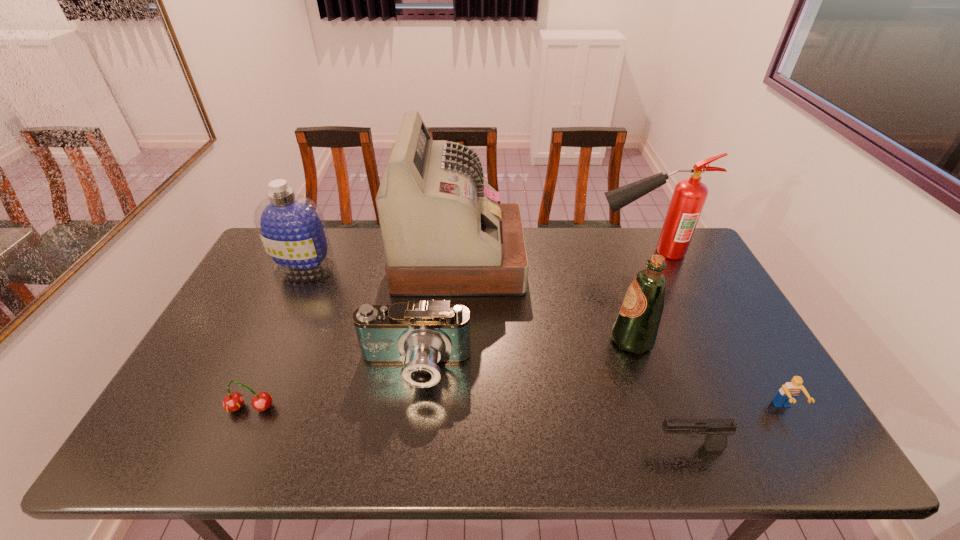
Locate an element on the screen. The height and width of the screenshot is (540, 960). vacant point located 0.120m at the nozzle of the fire extinguisher is located at coordinates (559, 252).

This screenshot has height=540, width=960. In order to click on free spot located 0.170m at the nozzle of the fire extinguisher in this screenshot , I will do `click(544, 252)`.

Locate an element on the screen. The image size is (960, 540). free space located 0.060m on the back of the cleansing agent is located at coordinates (317, 243).

In order to click on vacant space located on the front-facing side of the olive oil in this screenshot , I will do `click(499, 340)`.

Where is `vacant space positioned 0.050m on the front-facing side of the olive oil`? This screenshot has width=960, height=540. vacant space positioned 0.050m on the front-facing side of the olive oil is located at coordinates (592, 340).

Find the location of a particular element. free space located 0.140m on the front-facing side of the olive oil is located at coordinates (560, 340).

Identify the location of vacant space situated on the front-facing side of the fourth shortest object. The height and width of the screenshot is (540, 960). pos(402,460).

This screenshot has height=540, width=960. I want to click on vacant space positioned 0.070m aim along the barrel of the pistol, so click(x=623, y=448).

What are the coordinates of `vacant space located 0.220m aim along the barrel of the pistol` in the screenshot? It's located at (557, 448).

The image size is (960, 540). I want to click on vacant space positioned aim along the barrel of the pistol, so click(548, 448).